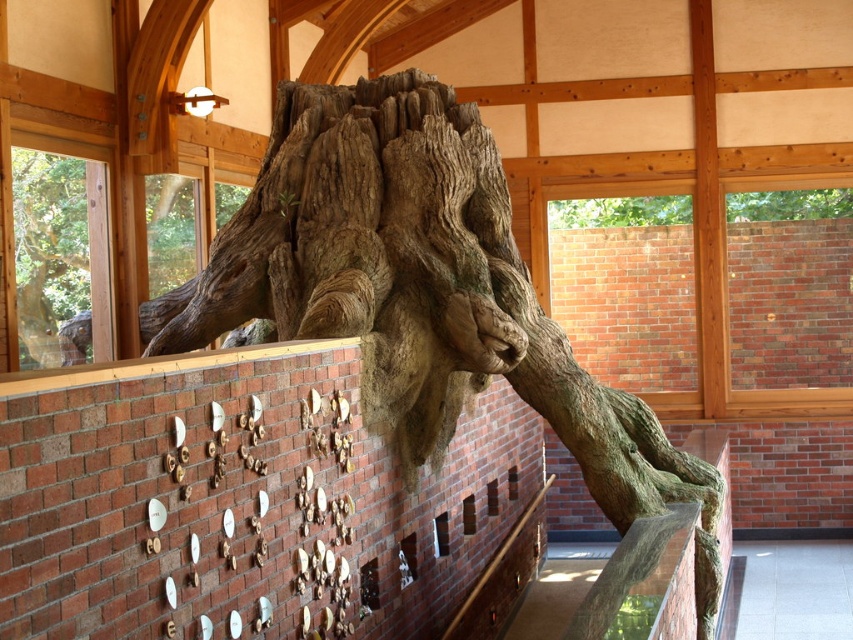
Question: Can you confirm if brown rough tree trunk at left is positioned above brown rough bark at upper center?

Choices:
 (A) no
 (B) yes

Answer: (A)

Question: Estimate the real-world distances between objects in this image. Which object is closer to the brown rough bark at upper center?

Choices:
 (A) brown rough tree trunk at left
 (B) natural wood tree trunk at center

Answer: (B)

Question: Does natural wood tree trunk at center appear under brown rough tree trunk at left?

Choices:
 (A) yes
 (B) no

Answer: (A)

Question: Estimate the real-world distances between objects in this image. Which object is farther from the natural wood tree trunk at center?

Choices:
 (A) brown rough bark at upper center
 (B) brown rough tree trunk at left

Answer: (A)

Question: Which point is farther to the camera?

Choices:
 (A) (366, 157)
 (B) (57, 300)
 (C) (830, 205)

Answer: (C)

Question: Is natural wood tree trunk at center to the right of brown rough bark at upper center from the viewer's perspective?

Choices:
 (A) yes
 (B) no

Answer: (B)